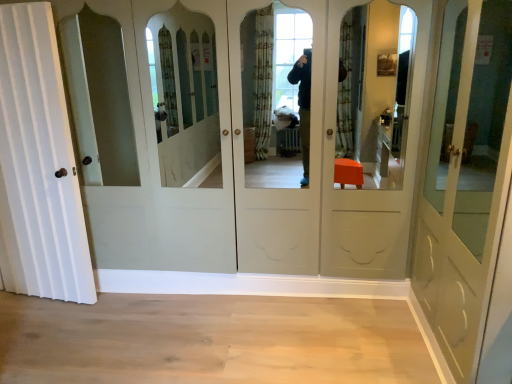
Question: Would you say white wood door at left, the second door from the right, contains matte white door at right, which is counted as the first door, starting from the right?

Choices:
 (A) no
 (B) yes

Answer: (A)

Question: Is the depth of white wood door at left, the second door from the right, greater than that of matte white door at right, the 2th door positioned from the left?

Choices:
 (A) no
 (B) yes

Answer: (B)

Question: Is white wood door at left, the second door from the right, thinner than matte white door at right, which is counted as the first door, starting from the right?

Choices:
 (A) yes
 (B) no

Answer: (A)

Question: From the image's perspective, would you say white wood door at left, the second door from the right, is shown under matte white door at right, the 2th door positioned from the left?

Choices:
 (A) yes
 (B) no

Answer: (B)

Question: Is the surface of white wood door at left, the second door from the right, in direct contact with matte white door at right, the 2th door positioned from the left?

Choices:
 (A) yes
 (B) no

Answer: (B)

Question: Considering the relative positions of white wood door at left, the second door from the right, and matte white door at right, which is counted as the first door, starting from the right, in the image provided, is white wood door at left, the second door from the right, to the right of matte white door at right, which is counted as the first door, starting from the right, from the viewer's perspective?

Choices:
 (A) yes
 (B) no

Answer: (B)

Question: Does matte white door at right, which is counted as the first door, starting from the right, have a smaller size compared to white wood door at left, placed as the 1th door when sorted from left to right?

Choices:
 (A) yes
 (B) no

Answer: (B)

Question: Is matte white door at right, which is counted as the first door, starting from the right, with white wood door at left, the second door from the right?

Choices:
 (A) no
 (B) yes

Answer: (A)

Question: Does matte white door at right, which is counted as the first door, starting from the right, have a lesser width compared to white wood door at left, placed as the 1th door when sorted from left to right?

Choices:
 (A) yes
 (B) no

Answer: (B)

Question: From the image's perspective, is matte white door at right, which is counted as the first door, starting from the right, located above white wood door at left, placed as the 1th door when sorted from left to right?

Choices:
 (A) yes
 (B) no

Answer: (B)

Question: Are matte white door at right, the 2th door positioned from the left, and white wood door at left, placed as the 1th door when sorted from left to right, far apart?

Choices:
 (A) yes
 (B) no

Answer: (A)

Question: From the image's perspective, is matte white door at right, the 2th door positioned from the left, beneath white wood door at left, the second door from the right?

Choices:
 (A) yes
 (B) no

Answer: (A)

Question: Considering the positions of matte white door at right, which is counted as the first door, starting from the right, and white wood door at left, placed as the 1th door when sorted from left to right, in the image, is matte white door at right, which is counted as the first door, starting from the right, wider or thinner than white wood door at left, placed as the 1th door when sorted from left to right,?

Choices:
 (A) thin
 (B) wide

Answer: (B)